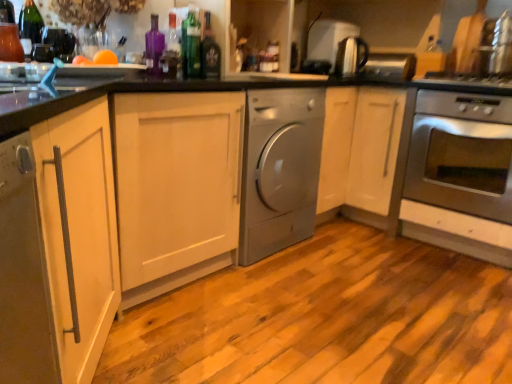
Question: Would you say satin silver toaster at upper center, the second appliance viewed from the front, is outside purple glass bottle at upper center, the second bottle positioned from the left?

Choices:
 (A) no
 (B) yes

Answer: (B)

Question: Is satin silver toaster at upper center, which is counted as the 1th appliance, starting from the back, facing towards purple glass bottle at upper center, the 3th bottle when ordered from right to left?

Choices:
 (A) no
 (B) yes

Answer: (A)

Question: Can you confirm if satin silver toaster at upper center, which is counted as the 1th appliance, starting from the back, is thinner than purple glass bottle at upper center, the 3th bottle when ordered from right to left?

Choices:
 (A) no
 (B) yes

Answer: (A)

Question: Does satin silver toaster at upper center, the second appliance viewed from the front, have a greater width compared to purple glass bottle at upper center, the 3th bottle when ordered from right to left?

Choices:
 (A) yes
 (B) no

Answer: (A)

Question: Is satin silver toaster at upper center, which is counted as the 1th appliance, starting from the back, to the right of purple glass bottle at upper center, the 3th bottle when ordered from right to left, from the viewer's perspective?

Choices:
 (A) yes
 (B) no

Answer: (A)

Question: Considering the positions of matte glass bottle at upper left, which is counted as the fourth bottle, starting from the right, and satin silver dryer at center in the image, is matte glass bottle at upper left, which is counted as the fourth bottle, starting from the right, bigger or smaller than satin silver dryer at center?

Choices:
 (A) small
 (B) big

Answer: (A)

Question: Is matte glass bottle at upper left, which is counted as the fourth bottle, starting from the right, in front of or behind satin silver dryer at center in the image?

Choices:
 (A) front
 (B) behind

Answer: (A)

Question: In terms of height, does matte glass bottle at upper left, which is counted as the fourth bottle, starting from the right, look taller or shorter compared to satin silver dryer at center?

Choices:
 (A) tall
 (B) short

Answer: (B)

Question: From a real-world perspective, is matte glass bottle at upper left, arranged as the first bottle when viewed from the left, physically located above or below satin silver dryer at center?

Choices:
 (A) above
 (B) below

Answer: (A)

Question: Considering their positions, is purple glass bottle at upper center, the 3th bottle when ordered from right to left, located in front of or behind green glass bottle at upper center, which is the third bottle in left-to-right order?

Choices:
 (A) front
 (B) behind

Answer: (A)

Question: Is purple glass bottle at upper center, the second bottle positioned from the left, inside the boundaries of green glass bottle at upper center, which is the third bottle in left-to-right order, or outside?

Choices:
 (A) outside
 (B) inside

Answer: (A)

Question: Looking at the image, does purple glass bottle at upper center, the second bottle positioned from the left, seem bigger or smaller compared to green glass bottle at upper center, which is the 2th bottle in right-to-left order?

Choices:
 (A) small
 (B) big

Answer: (A)

Question: Does point (154, 31) appear closer or farther from the camera than point (194, 64)?

Choices:
 (A) closer
 (B) farther

Answer: (B)

Question: Visually, is shiny dark glass bottle at center, which is counted as the 4th bottle, starting from the left, positioned to the left or to the right of satin silver kettle at upper right, the first appliance when ordered from front to back?

Choices:
 (A) right
 (B) left

Answer: (B)

Question: Does point pos(203,38) appear closer or farther from the camera than point pos(356,49)?

Choices:
 (A) closer
 (B) farther

Answer: (A)